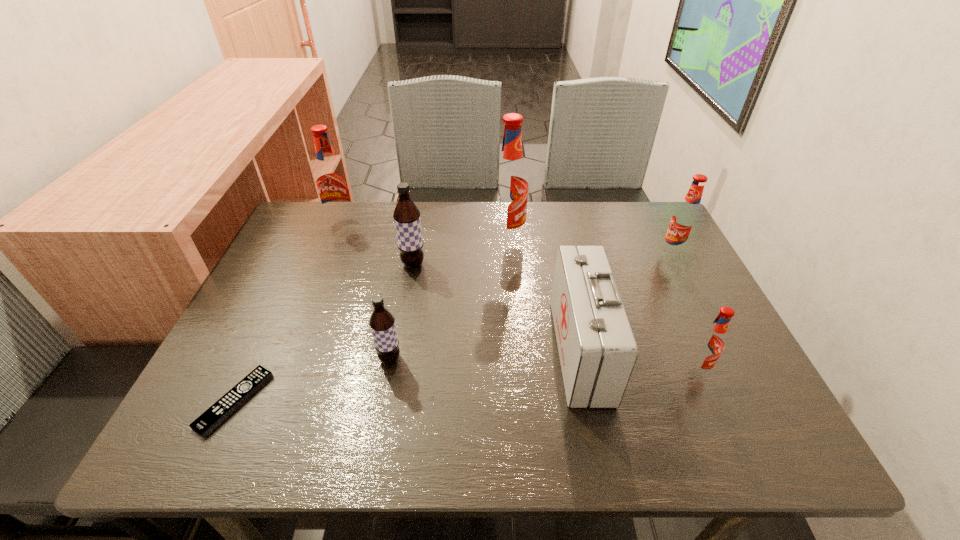
Find the location of a particular element. the biggest red root beer is located at coordinates (509, 185).

You are a GUI agent. You are given a task and a screenshot of the screen. Output one action in this format:
    pyautogui.click(x=<x>, y=<y>)
    Task: Click on the third root beer from right to left
    The width and height of the screenshot is (960, 540).
    Given the screenshot: What is the action you would take?
    pyautogui.click(x=509, y=185)

Identify the location of the second tallest object. This screenshot has width=960, height=540. (331, 181).

Locate an element on the screen. The width and height of the screenshot is (960, 540). the leftmost red root beer is located at coordinates (331, 181).

You are a GUI agent. You are given a task and a screenshot of the screen. Output one action in this format:
    pyautogui.click(x=<x>, y=<y>)
    Task: Click on the rightmost red root beer
    The image size is (960, 540).
    Given the screenshot: What is the action you would take?
    pyautogui.click(x=685, y=219)

Locate an element on the screen. the rightmost object is located at coordinates (685, 219).

The image size is (960, 540). Find the location of `the farther brown root beer`. the farther brown root beer is located at coordinates (406, 215).

This screenshot has height=540, width=960. I want to click on the first-aid kit, so click(x=597, y=349).

Where is `red first-aid kit`? The image size is (960, 540). red first-aid kit is located at coordinates (597, 349).

The height and width of the screenshot is (540, 960). Find the location of `the nearer brown root beer`. the nearer brown root beer is located at coordinates (382, 322).